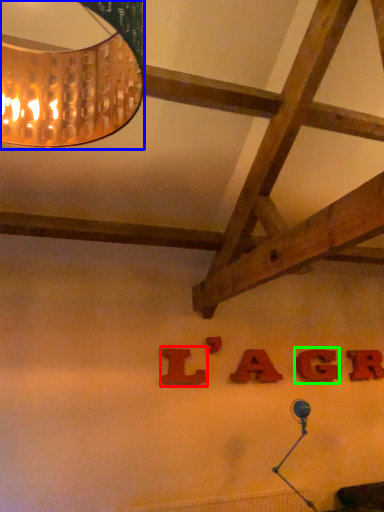
Question: Considering the real-world distances, which object is closest to letter (highlighted by a red box)? lamp (highlighted by a blue box) or letter (highlighted by a green box).

Choices:
 (A) lamp
 (B) letter

Answer: (B)